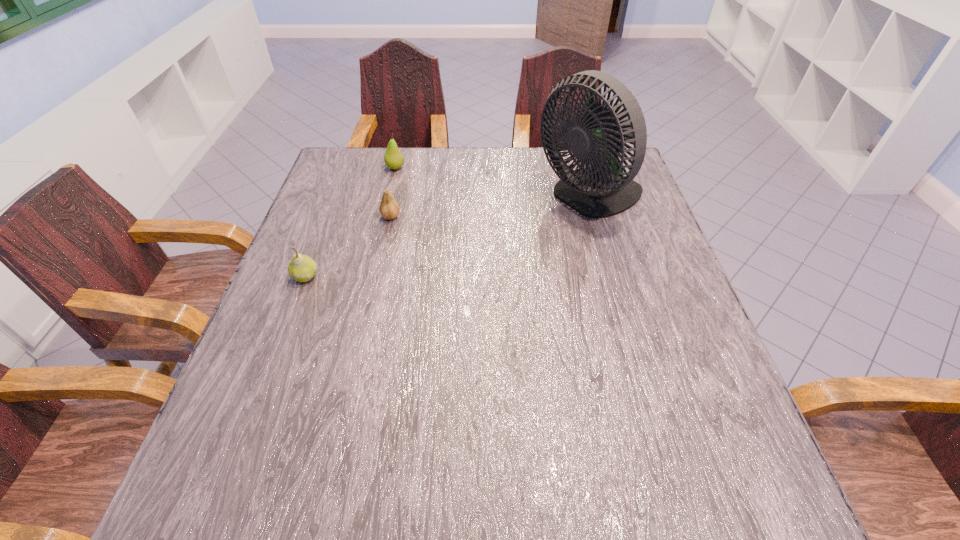
Where is `empty location between the rightmost object and the nearest object`? empty location between the rightmost object and the nearest object is located at coordinates (448, 237).

Identify the location of blank region between the farthest pear and the second farthest pear. This screenshot has height=540, width=960. (393, 192).

Locate an element on the screen. free space that is in between the second nearest pear and the farthest pear is located at coordinates (393, 192).

I want to click on empty space that is in between the rightmost object and the leftmost object, so (x=448, y=237).

Locate which object is the third closest to the leftmost pear. Please provide its 2D coordinates. Your answer should be formatted as a tuple, i.e. [(x, y)], where the tuple contains the x and y coordinates of a point satisfying the conditions above.

[(599, 188)]

Identify the location of the second closest object to the second nearest pear. (302, 268).

This screenshot has width=960, height=540. What are the coordinates of `pear object that ranks as the closest to the farthest pear` in the screenshot? It's located at (389, 209).

At what (x,y) coordinates should I click in order to perform the action: click on pear that can be found as the second closest to the leftmost pear. Please return your answer as a coordinate pair (x, y). The image size is (960, 540). Looking at the image, I should click on (393, 158).

The image size is (960, 540). What are the coordinates of `free location that satisfies the following two spatial constraints: 1. in front of the tallest object to direct airflow; 2. on the front side of the leftmost object` in the screenshot? It's located at (613, 276).